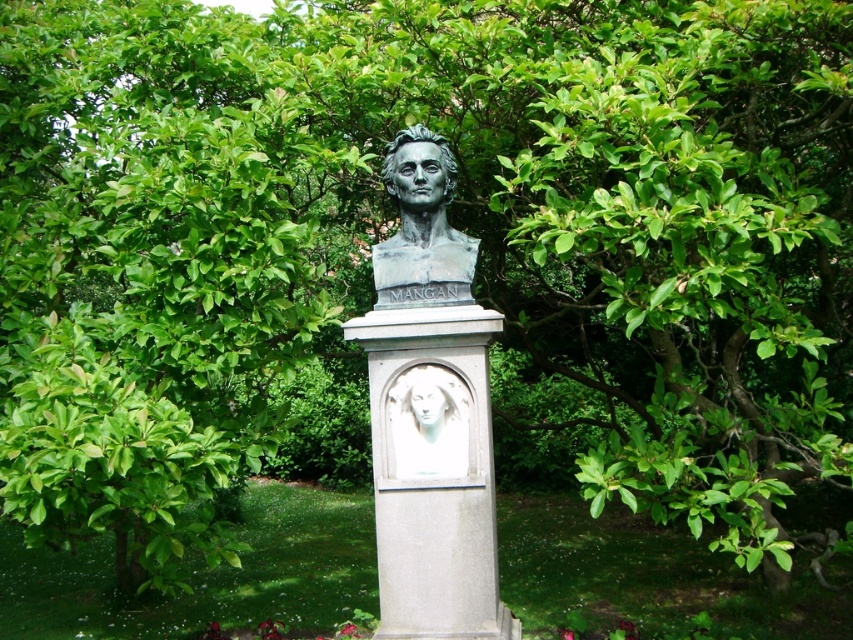
You are standing at the center of the outdoor area and want to place two decorative stones at the specified coordinates. The first stone is at point (396, 196) and the second at point (463, 397). Based on their positions, which point is closer to the stone pedestal?

Point (463, 397) is closer to the stone pedestal because it is in front of point (396, 196), which is behind it.